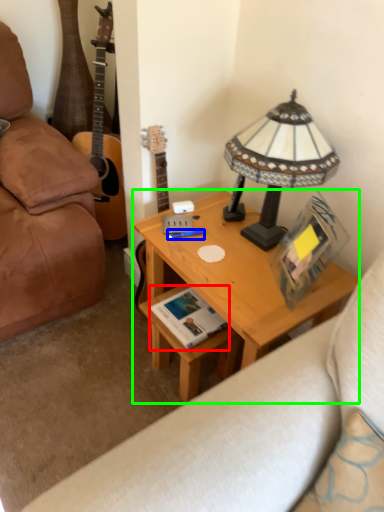
Question: Which object is positioned closest to book (highlighted by a red box)? Select from pen (highlighted by a blue box) and desk (highlighted by a green box).

Choices:
 (A) pen
 (B) desk

Answer: (B)